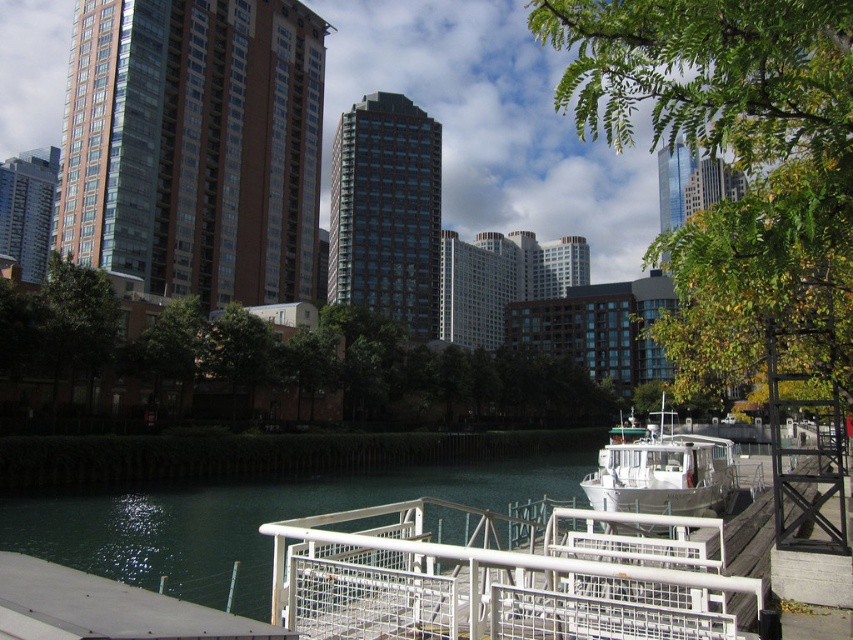
Question: Which point is farther from the camera taking this photo?

Choices:
 (A) coord(338,636)
 (B) coord(355,371)
 (C) coord(42,637)

Answer: (B)

Question: Is white metal railing at lower center thinner than white matte boat at center?

Choices:
 (A) yes
 (B) no

Answer: (A)

Question: Which point is closer to the camera?

Choices:
 (A) (683, 492)
 (B) (485, 396)
 (C) (717, 284)

Answer: (C)

Question: Can you confirm if white metal railing at lower center is thinner than smooth concrete dock at lower left?

Choices:
 (A) no
 (B) yes

Answer: (A)

Question: Which of these objects is positioned farthest from the white matte boat at center?

Choices:
 (A) green leafy tree at center
 (B) white metal railing at lower center
 (C) smooth concrete dock at lower left
 (D) green leafy tree at upper right

Answer: (C)

Question: In this image, where is green leafy tree at center located relative to white matte boat at center?

Choices:
 (A) below
 (B) above

Answer: (B)